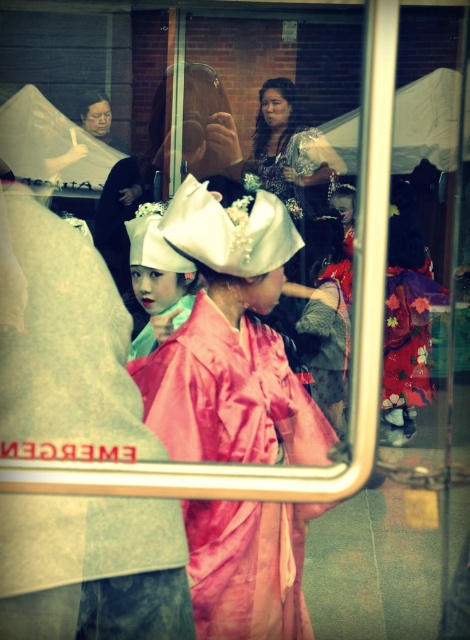
Question: Is pink satin kimono at center in front of white satin hat at center?

Choices:
 (A) yes
 (B) no

Answer: (A)

Question: Is matte floral dress at center below white satin hat at center?

Choices:
 (A) yes
 (B) no

Answer: (B)

Question: Which object appears closest to the camera in this image?

Choices:
 (A) white satin hat at center
 (B) matte floral dress at center

Answer: (B)

Question: Can you confirm if pink satin kimono at center is positioned below white satin hat at center?

Choices:
 (A) yes
 (B) no

Answer: (A)

Question: Which of the following is the closest to the observer?

Choices:
 (A) (83, 566)
 (B) (242, 301)
 (C) (193, 268)
 (D) (249, 168)

Answer: (A)

Question: Which is nearer to the satin pink kimono at center?

Choices:
 (A) white satin hat at center
 (B) pink satin kimono at center
 (C) matte floral dress at center

Answer: (A)